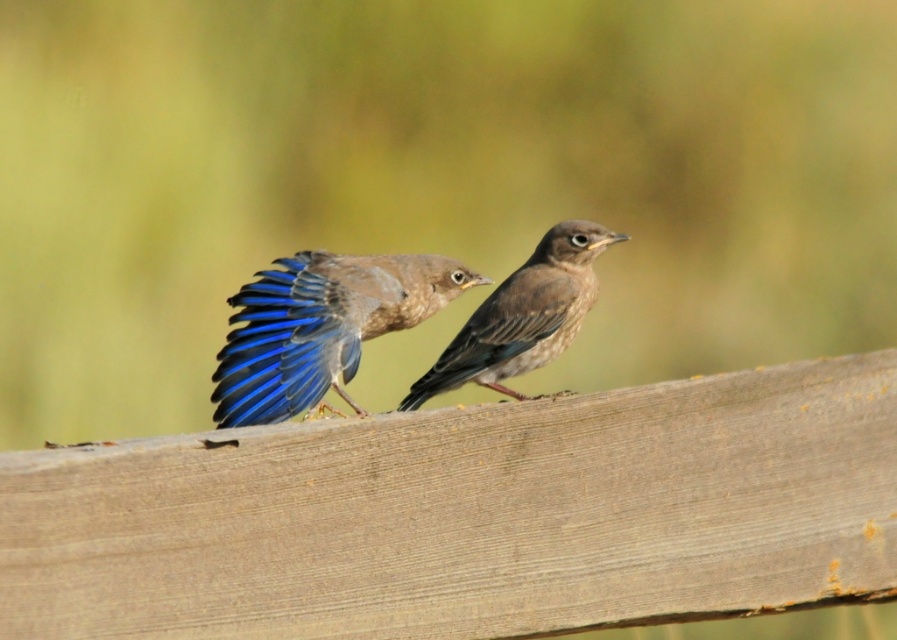
Is point (360, 449) farther from viewer compared to point (573, 260)?

No.

Is brown wooden plank at center further to the viewer compared to brown matte bird at center?

That is False.

Is point (846, 532) positioned before point (463, 330)?

Yes.

Find the location of a particular element. This screenshot has height=640, width=897. brown wooden plank at center is located at coordinates (469, 515).

Between point (431, 426) and point (327, 362), which one is positioned in front?

Positioned in front is point (431, 426).

Does brown wooden plank at center have a greater height compared to blue glossy wing at center?

Indeed, brown wooden plank at center has a greater height compared to blue glossy wing at center.

Locate an element on the screen. This screenshot has height=640, width=897. brown wooden plank at center is located at coordinates (469, 515).

Which is more to the left, blue glossy wing at center or brown matte bird at center?

Positioned to the left is blue glossy wing at center.

Does point (353, 332) come closer to viewer compared to point (563, 304)?

Yes, point (353, 332) is in front of point (563, 304).

Identify the location of blue glossy wing at center. The image size is (897, 640). click(x=320, y=326).